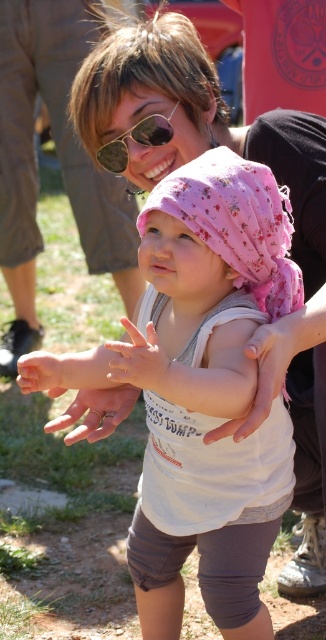
Measure the distance between pink fabric hat at center and white matte hand at center.

The distance of pink fabric hat at center from white matte hand at center is 12.24 inches.

Can you confirm if pink fabric hat at center is taller than white matte hand at center?

Yes.

This screenshot has height=640, width=326. I want to click on pink fabric hat at center, so click(211, 394).

Where is `pink fabric hat at center`? The height and width of the screenshot is (640, 326). pink fabric hat at center is located at coordinates (211, 394).

Is pink fabric hat at center wider than matte black sunglasses at upper center?

Incorrect, pink fabric hat at center's width does not surpass matte black sunglasses at upper center's.

Is point (164, 508) behind point (121, 292)?

No, it is not.

This screenshot has height=640, width=326. What are the coordinates of `pink fabric hat at center` in the screenshot? It's located at (211, 394).

Looking at this image, does matte black sunglasses at upper center appear over smooth skin hand at center?

Correct, matte black sunglasses at upper center is located above smooth skin hand at center.

Is point (126, 268) positioned behind point (54, 384)?

Yes, it is.

Is point (36, 326) more distant than point (70, 360)?

Yes, it is behind point (70, 360).

Where is `matte black sunglasses at upper center`? Image resolution: width=326 pixels, height=640 pixels. matte black sunglasses at upper center is located at coordinates (59, 157).